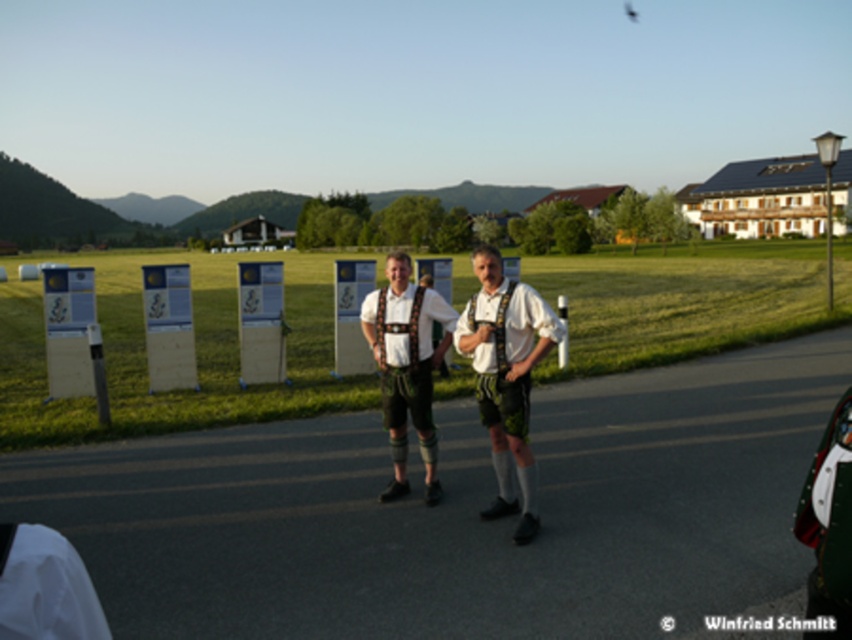
Does matte white shirt at center come in front of leather-like suspenders at center?

Yes, matte white shirt at center is in front of leather-like suspenders at center.

What do you see at coordinates (505, 376) in the screenshot? The width and height of the screenshot is (852, 640). I see `matte white shirt at center` at bounding box center [505, 376].

Who is more distant from viewer, (531,328) or (390,312)?

The point (390,312) is more distant.

What are the coordinates of `matte white shirt at center` in the screenshot? It's located at (505, 376).

Does matte white shirt at center have a lesser height compared to khaki fabric at lower left?

No, matte white shirt at center is not shorter than khaki fabric at lower left.

Is matte white shirt at center above khaki fabric at lower left?

Actually, matte white shirt at center is below khaki fabric at lower left.

Who is more distant from viewer, [456,339] or [10,602]?

Positioned behind is point [456,339].

The height and width of the screenshot is (640, 852). Find the location of `matte white shirt at center`. matte white shirt at center is located at coordinates (505, 376).

Which is more to the left, leather-like suspenders at center or khaki fabric at lower left?

khaki fabric at lower left is more to the left.

Who is taller, leather-like suspenders at center or khaki fabric at lower left?

With more height is leather-like suspenders at center.

Describe the element at coordinates (406, 365) in the screenshot. I see `leather-like suspenders at center` at that location.

You are a GUI agent. You are given a task and a screenshot of the screen. Output one action in this format:
    pyautogui.click(x=<x>, y=<y>)
    Task: Click on the leather-like suspenders at center
    This screenshot has width=852, height=640.
    Given the screenshot: What is the action you would take?
    pyautogui.click(x=406, y=365)